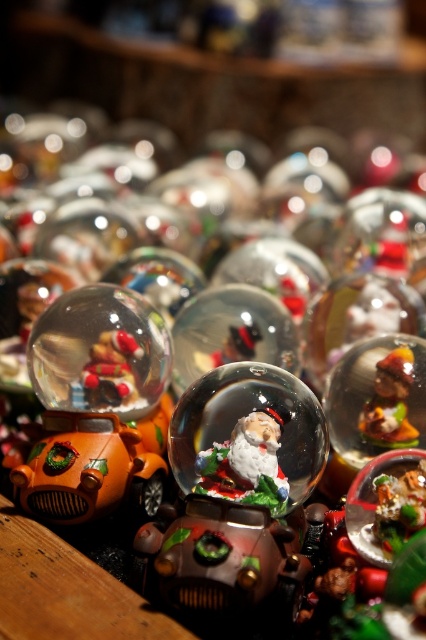
Question: Where is translucent glass snow globe at center located in relation to clear glass snow globe at center in the image?

Choices:
 (A) right
 (B) left

Answer: (A)

Question: Based on their relative distances, which object is farther from the shiny silver santa at center?

Choices:
 (A) translucent glass snow globe at center
 (B) clear glass snow globe at center

Answer: (B)

Question: Can you confirm if translucent glass snow globe at center is positioned below shiny silver santa at center?

Choices:
 (A) yes
 (B) no

Answer: (B)

Question: Which point is closer to the camera?

Choices:
 (A) (184, 428)
 (B) (273, 456)

Answer: (B)

Question: Is translucent glass snow globe at center bigger than clear glass snow globe at center?

Choices:
 (A) no
 (B) yes

Answer: (B)

Question: Which of these objects is positioned farthest from the shiny silver santa at center?

Choices:
 (A) translucent glass snow globe at center
 (B) clear glass snow globe at center

Answer: (B)